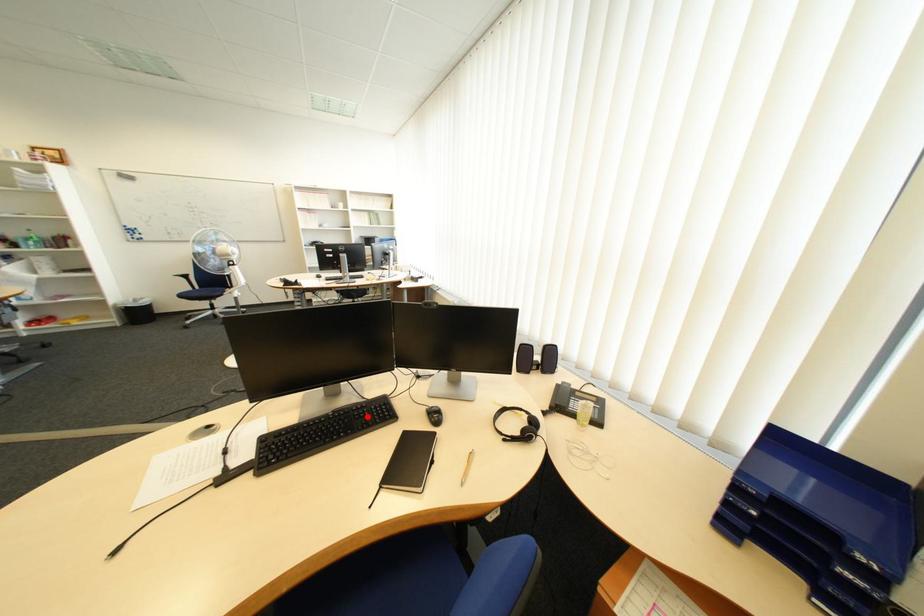
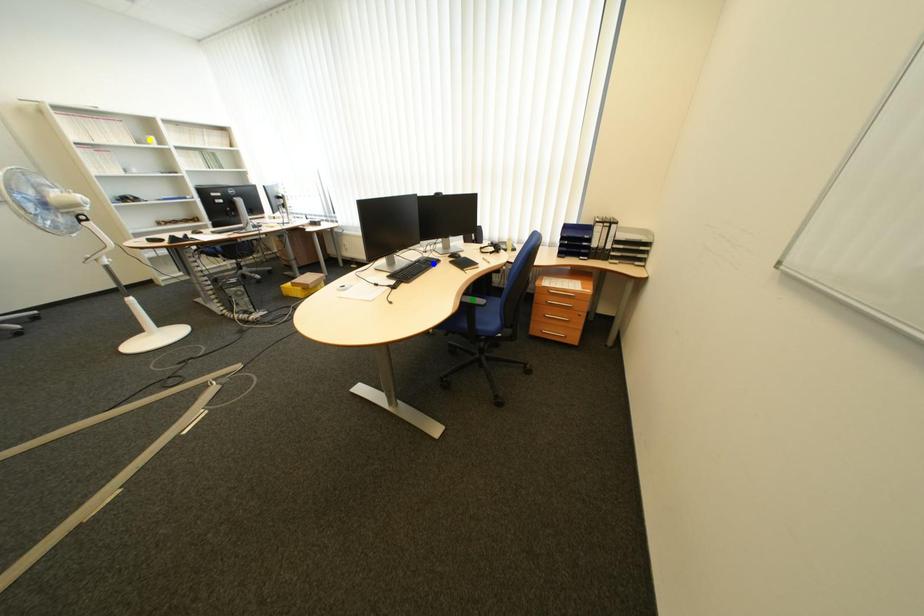
Question: I am providing you with two images of the same scene from different viewpoints. A red point is marked on the first image. You are given multiple points on the second image. Which point in image 2 is actually the same real-world point as the red point in image 1?

Choices:
 (A) green point
 (B) blue point
 (C) yellow point

Answer: (B)